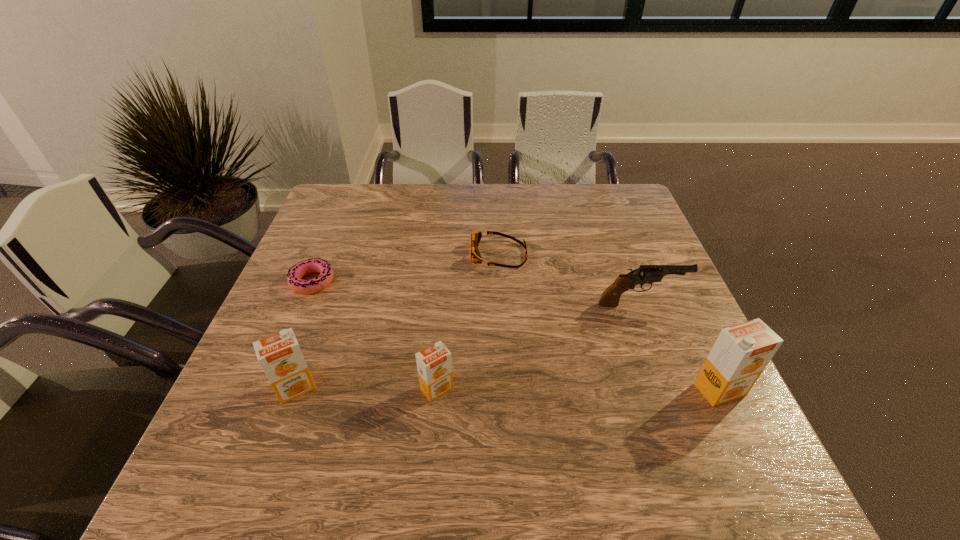
At what (x,y) coordinates should I click in order to perform the action: click on empty location between the rightmost orange juice and the second shortest object. Please return your answer as a coordinate pair (x, y). Looking at the image, I should click on (610, 322).

Image resolution: width=960 pixels, height=540 pixels. I want to click on free spot between the fourth nearest object and the tallest orange juice, so click(680, 347).

Locate an element on the screen. vacant region between the leftmost orange juice and the doughnut is located at coordinates (304, 335).

This screenshot has height=540, width=960. In order to click on free space between the gun and the rightmost orange juice in this screenshot , I will do pos(680,347).

The width and height of the screenshot is (960, 540). I want to click on vacant space in between the tallest orange juice and the shortest object, so click(x=516, y=335).

Identify the location of free space between the third object from right to left and the second orange juice from right to left. (468, 321).

Image resolution: width=960 pixels, height=540 pixels. In order to click on vacant space that's between the gun and the goggles in this screenshot , I will do `click(569, 279)`.

Locate an element on the screen. Image resolution: width=960 pixels, height=540 pixels. free space between the second shortest object and the tallest object is located at coordinates (610, 322).

Where is `free space between the shortest object and the fourth object from left to right`? The image size is (960, 540). free space between the shortest object and the fourth object from left to right is located at coordinates (405, 268).

I want to click on vacant space that is in between the second shortest orange juice and the goggles, so click(x=397, y=321).